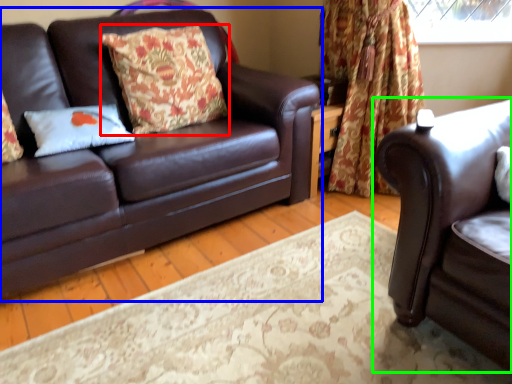
Question: Which is farther away from pillow (highlighted by a red box)? studio couch (highlighted by a blue box) or studio couch (highlighted by a green box)?

Choices:
 (A) studio couch
 (B) studio couch

Answer: (B)